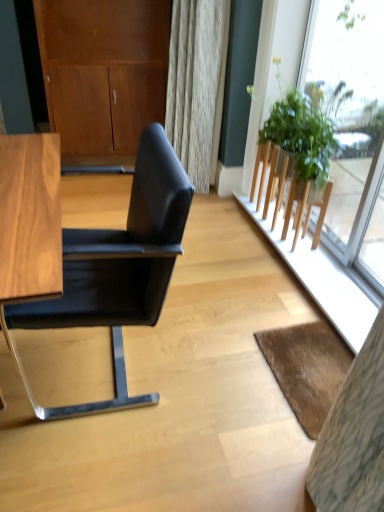
Find the location of `free space underneath green leafy plant at right (from a real-world perspective)`. free space underneath green leafy plant at right (from a real-world perspective) is located at coordinates (287, 250).